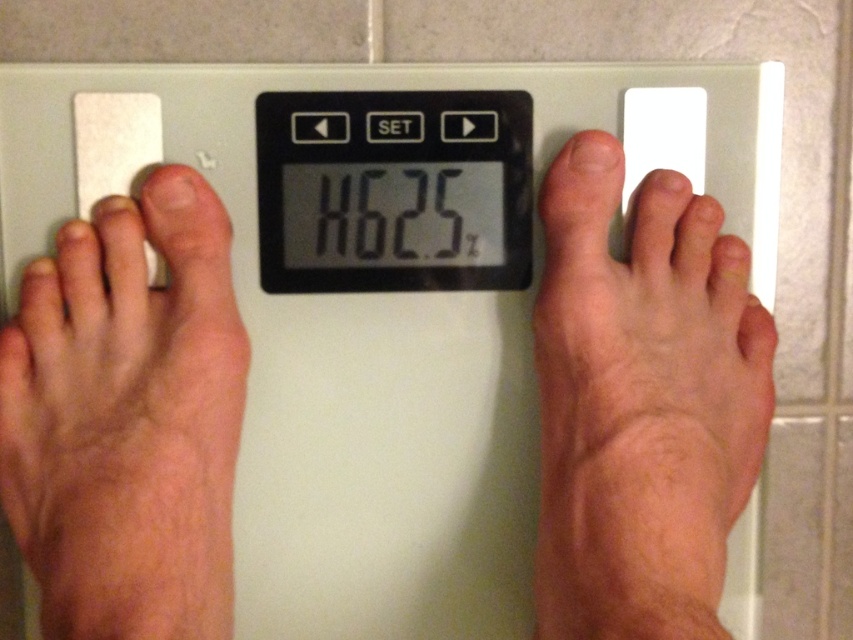
Question: Which point appears farthest from the camera in this image?

Choices:
 (A) (428, 176)
 (B) (556, 166)
 (C) (61, 536)
 (D) (125, 244)

Answer: (A)

Question: Can you confirm if skinny bare feet at center is wider than dry skin foot at left?

Choices:
 (A) no
 (B) yes

Answer: (B)

Question: Is pale skin at right positioned behind black plastic scale at center?

Choices:
 (A) yes
 (B) no

Answer: (B)

Question: Based on their relative distances, which object is farther from the black plastic scale at center?

Choices:
 (A) white plastic scale at center
 (B) dry skin foot at left
 (C) pale skin at right
 (D) skinny bare feet at center

Answer: (B)

Question: Which of these objects is positioned closest to the dry skin foot at left?

Choices:
 (A) white plastic scale at center
 (B) black plastic scale at center

Answer: (B)

Question: Is pale skin at right above white plastic scale at center?

Choices:
 (A) no
 (B) yes

Answer: (A)